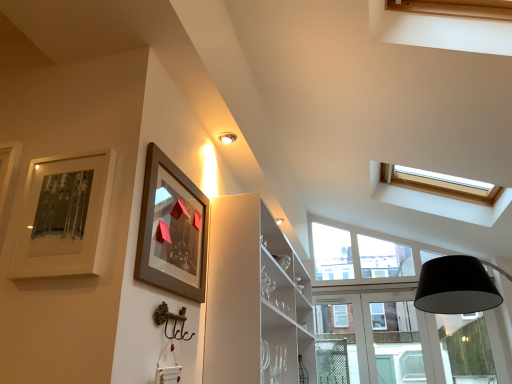
Question: From a real-world perspective, is clear glass window at center under matte brown picture frame at upper left, which appears as the second picture frame when viewed from the left?

Choices:
 (A) no
 (B) yes

Answer: (B)

Question: Considering the relative sizes of clear glass window at center and matte brown picture frame at upper left, acting as the first picture frame starting from the right, in the image provided, is clear glass window at center taller than matte brown picture frame at upper left, acting as the first picture frame starting from the right,?

Choices:
 (A) yes
 (B) no

Answer: (A)

Question: Does clear glass window at center turn towards matte brown picture frame at upper left, which appears as the second picture frame when viewed from the left?

Choices:
 (A) yes
 (B) no

Answer: (A)

Question: Is the depth of clear glass window at center greater than that of matte brown picture frame at upper left, acting as the first picture frame starting from the right?

Choices:
 (A) yes
 (B) no

Answer: (A)

Question: Does clear glass window at center have a lesser height compared to matte brown picture frame at upper left, which appears as the second picture frame when viewed from the left?

Choices:
 (A) yes
 (B) no

Answer: (B)

Question: Considering their positions, is matte silver picture frame at upper left, which appears as the 2th picture frame when viewed from the right, located in front of or behind clear glass window at center?

Choices:
 (A) front
 (B) behind

Answer: (A)

Question: Is point (42, 205) positioned closer to the camera than point (371, 334)?

Choices:
 (A) farther
 (B) closer

Answer: (B)

Question: Would you say matte silver picture frame at upper left, which appears as the 2th picture frame when viewed from the right, is to the left or to the right of clear glass window at center in the picture?

Choices:
 (A) left
 (B) right

Answer: (A)

Question: From the image's perspective, is matte silver picture frame at upper left, the 1th picture frame from the left, located above or below clear glass window at center?

Choices:
 (A) above
 (B) below

Answer: (A)

Question: Is matte brown picture frame at upper left, which appears as the second picture frame when viewed from the left, in front of or behind matte silver picture frame at upper left, the 1th picture frame from the left, in the image?

Choices:
 (A) behind
 (B) front

Answer: (A)

Question: Based on their positions, is matte brown picture frame at upper left, acting as the first picture frame starting from the right, located to the left or right of matte silver picture frame at upper left, which appears as the 2th picture frame when viewed from the right?

Choices:
 (A) left
 (B) right

Answer: (B)

Question: From a real-world perspective, is matte brown picture frame at upper left, which appears as the second picture frame when viewed from the left, above or below matte silver picture frame at upper left, which appears as the 2th picture frame when viewed from the right?

Choices:
 (A) above
 (B) below

Answer: (A)

Question: In terms of width, does matte brown picture frame at upper left, which appears as the second picture frame when viewed from the left, look wider or thinner when compared to matte silver picture frame at upper left, which appears as the 2th picture frame when viewed from the right?

Choices:
 (A) wide
 (B) thin

Answer: (A)

Question: In the image, is clear glass window at center positioned in front of or behind matte brown picture frame at upper left, which appears as the second picture frame when viewed from the left?

Choices:
 (A) behind
 (B) front

Answer: (A)

Question: Does point (328, 231) appear closer or farther from the camera than point (174, 271)?

Choices:
 (A) farther
 (B) closer

Answer: (A)